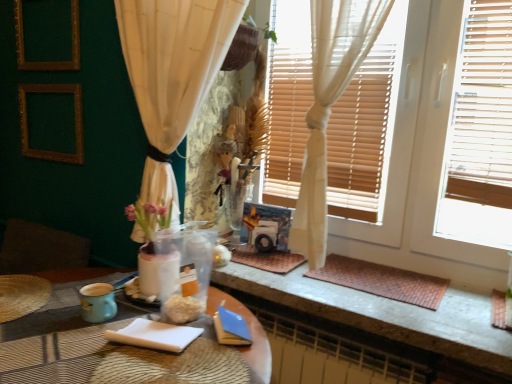
Image resolution: width=512 pixels, height=384 pixels. Describe the element at coordinates (97, 302) in the screenshot. I see `teal ceramic mug at lower left` at that location.

What is the approximate width of white wood window frame at upper right?

The width of white wood window frame at upper right is 4.94 inches.

Locate an element on the screen. gold wooden picture frame at upper left, which is the 1th picture frame from top to bottom is located at coordinates (48, 62).

The width and height of the screenshot is (512, 384). What do you see at coordinates (48, 62) in the screenshot? I see `gold wooden picture frame at upper left, the second picture frame in the bottom-to-top sequence` at bounding box center [48, 62].

What is the approximate width of brown woven mat at lower right?

It is 11.18 inches.

The width and height of the screenshot is (512, 384). Describe the element at coordinates (75, 122) in the screenshot. I see `gold textured picture frame at upper left, the 2th picture frame from the top` at that location.

Where is `teal ceramic mug at lower left`? Image resolution: width=512 pixels, height=384 pixels. teal ceramic mug at lower left is located at coordinates (97, 302).

In the scene shown: Is matte plastic table at center taller or shorter than brown woven mat at lower right?

Considering their sizes, matte plastic table at center has more height than brown woven mat at lower right.

Is matte plastic table at center turned away from brown woven mat at lower right?

Yes.

Does matte plastic table at center lie behind brown woven mat at lower right?

No, matte plastic table at center is closer to the viewer.

Is matte plastic table at center spatially inside brown woven mat at lower right, or outside of it?

matte plastic table at center cannot be found inside brown woven mat at lower right.

Which is behind, point (418, 302) or point (413, 11)?

The point (413, 11) is farther.

From the image's perspective, between brown woven mat at lower right and white wood window frame at upper right, which one is located above?

white wood window frame at upper right is shown above in the image.

Is brown woven mat at lower right in front of or behind white wood window frame at upper right in the image?

brown woven mat at lower right is positioned farther from the viewer than white wood window frame at upper right.

Is brown woven mat at lower right wider than white wood window frame at upper right?

Correct, the width of brown woven mat at lower right exceeds that of white wood window frame at upper right.

From a real-world perspective, is teal ceramic mug at lower left above or below gold textured picture frame at upper left, the 2th picture frame from the top?

From a real-world perspective, teal ceramic mug at lower left is physically below gold textured picture frame at upper left, the 2th picture frame from the top.

Between point (105, 319) and point (44, 153), which one is positioned in front?

Point (105, 319)

Are teal ceramic mug at lower left and gold textured picture frame at upper left, the 2th picture frame from the top, located far from each other?

Yes, teal ceramic mug at lower left and gold textured picture frame at upper left, the 2th picture frame from the top, are located far from each other.

Between teal ceramic mug at lower left and gold textured picture frame at upper left, the 2th picture frame from the top, which one has smaller size?

Smaller between the two is teal ceramic mug at lower left.

How far apart are matte plastic table at center and gold textured picture frame at upper left, the 1th picture frame when ordered from bottom to top?

matte plastic table at center and gold textured picture frame at upper left, the 1th picture frame when ordered from bottom to top, are 3.58 feet apart.

Can you confirm if matte plastic table at center is thinner than gold textured picture frame at upper left, the 2th picture frame from the top?

Incorrect, the width of matte plastic table at center is not less than that of gold textured picture frame at upper left, the 2th picture frame from the top.

What's the angular difference between matte plastic table at center and gold textured picture frame at upper left, the 2th picture frame from the top,'s facing directions?

3.53 degrees.

From the image's perspective, which is above, matte plastic table at center or gold textured picture frame at upper left, the 1th picture frame when ordered from bottom to top?

gold textured picture frame at upper left, the 1th picture frame when ordered from bottom to top.

Could you tell me if gold textured picture frame at upper left, the 1th picture frame when ordered from bottom to top, is facing white wood window frame at upper right?

No, gold textured picture frame at upper left, the 1th picture frame when ordered from bottom to top, is not aimed at white wood window frame at upper right.

Is gold textured picture frame at upper left, the 1th picture frame when ordered from bottom to top, positioned far away from white wood window frame at upper right?

Yes, gold textured picture frame at upper left, the 1th picture frame when ordered from bottom to top, is far from white wood window frame at upper right.

Between gold textured picture frame at upper left, the 2th picture frame from the top, and white wood window frame at upper right, which one has smaller size?

gold textured picture frame at upper left, the 2th picture frame from the top, is smaller.

Is point (59, 154) closer or farther from the camera than point (502, 263)?

Clearly, point (59, 154) is more distant from the camera than point (502, 263).

Is white paper notepad at lower center bigger than teal ceramic mug at lower left?

Yes.

Is white paper notepad at lower center positioned behind teal ceramic mug at lower left?

No.

Is teal ceramic mug at lower left surrounded by white paper notepad at lower center?

That's incorrect, teal ceramic mug at lower left is not inside white paper notepad at lower center.

From a real-world perspective, is white paper notepad at lower center above or below teal ceramic mug at lower left?

white paper notepad at lower center is below teal ceramic mug at lower left.

The image size is (512, 384). What are the coordinates of `wide above the teal ceramic mug at lower left (from a real-world perspective)` in the screenshot? It's located at (382, 281).

Does teal ceramic mug at lower left have a greater height compared to brown woven mat at lower right?

Indeed, teal ceramic mug at lower left has a greater height compared to brown woven mat at lower right.

From the image's perspective, which object appears higher, teal ceramic mug at lower left or brown woven mat at lower right?

From the image's view, brown woven mat at lower right is above.

Is teal ceramic mug at lower left directly adjacent to brown woven mat at lower right?

No, teal ceramic mug at lower left is not beside brown woven mat at lower right.

Where is `wide above the matte plastic table at center (from the image's perspective)`? This screenshot has height=384, width=512. wide above the matte plastic table at center (from the image's perspective) is located at coordinates (382, 281).

Locate an element on the screen. Image resolution: width=512 pixels, height=384 pixels. wide directly beneath the white wood window frame at upper right (from a real-world perspective) is located at coordinates (382, 281).

When comparing their distances from brown woven mat at lower right, does gold wooden picture frame at upper left, the second picture frame in the bottom-to-top sequence, or white paper notepad at lower center seem closer?

white paper notepad at lower center.

Which object lies further to the anchor point white wood window frame at upper right, white paper notepad at lower center or brown woven mat at lower right?

white paper notepad at lower center is further to white wood window frame at upper right.

Estimate the real-world distances between objects in this image. Which object is further from white wood window frame at upper right, white paper notepad at lower center or gold wooden picture frame at upper left, the second picture frame in the bottom-to-top sequence?

gold wooden picture frame at upper left, the second picture frame in the bottom-to-top sequence.

When comparing their distances from white wood window frame at upper right, does brown woven mat at lower right or teal ceramic mug at lower left seem closer?

brown woven mat at lower right.

Looking at the image, which one is located closer to teal ceramic mug at lower left, gold wooden picture frame at upper left, the second picture frame in the bottom-to-top sequence, or gold textured picture frame at upper left, the 2th picture frame from the top?

gold textured picture frame at upper left, the 2th picture frame from the top, lies closer to teal ceramic mug at lower left than the other object.

Estimate the real-world distances between objects in this image. Which object is further from teal ceramic mug at lower left, brown woven mat at lower right or white paper notepad at lower center?

The object further to teal ceramic mug at lower left is brown woven mat at lower right.

Considering their positions, is white wood window frame at upper right positioned further to white paper notepad at lower center than matte plastic table at center?

white wood window frame at upper right is positioned further to the anchor white paper notepad at lower center.

Based on the photo, from the image, which object appears to be nearer to teal ceramic mug at lower left, gold wooden picture frame at upper left, the second picture frame in the bottom-to-top sequence, or white wood window frame at upper right?

white wood window frame at upper right lies closer to teal ceramic mug at lower left than the other object.

Locate an element on the screen. This screenshot has width=512, height=384. notepad located between gold textured picture frame at upper left, the 2th picture frame from the top, and brown woven mat at lower right in the left-right direction is located at coordinates (155, 335).

Find the location of a particular element. The width and height of the screenshot is (512, 384). window frame between matte plastic table at center and brown woven mat at lower right is located at coordinates (421, 164).

Image resolution: width=512 pixels, height=384 pixels. In order to click on window frame between teal ceramic mug at lower left and brown woven mat at lower right from left to right in this screenshot , I will do `click(421, 164)`.

Locate an element on the screen. This screenshot has height=384, width=512. notepad between matte plastic table at center and teal ceramic mug at lower left from front to back is located at coordinates (155, 335).